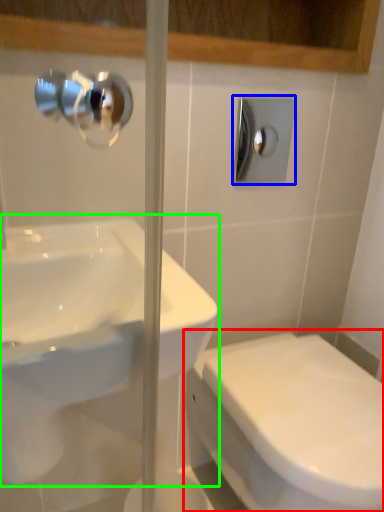
Question: Based on their relative distances, which object is farther from toilet (highlighted by a red box)? Choose from shower (highlighted by a blue box) and sink (highlighted by a green box).

Choices:
 (A) shower
 (B) sink

Answer: (A)